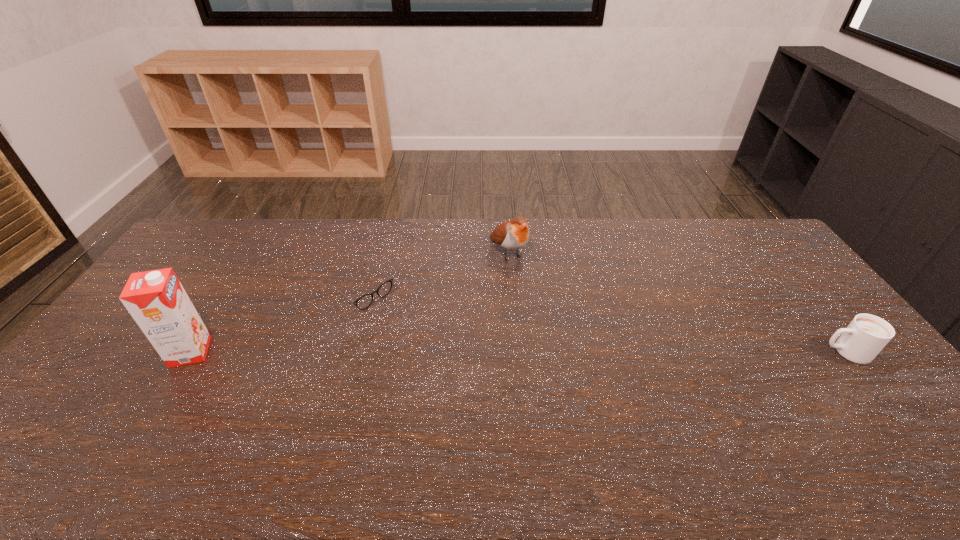
The width and height of the screenshot is (960, 540). In order to click on vacant area at the far edge of the desktop in this screenshot , I will do `click(343, 253)`.

This screenshot has width=960, height=540. Find the location of `blank area at the left edge`. blank area at the left edge is located at coordinates (178, 271).

In order to click on free region at the right edge of the desktop in this screenshot , I will do (796, 297).

Identify the location of vacant area at the near left corner. (45, 414).

This screenshot has width=960, height=540. In order to click on vacant space at the near right corner in this screenshot , I will do `click(848, 409)`.

The image size is (960, 540). I want to click on free space between the shortest object and the cappuccino, so click(x=603, y=321).

Identify the location of free point between the rightmost object and the third shortest object. (677, 302).

At what (x,y) coordinates should I click in order to perform the action: click on vacant point located between the shortest object and the leftmost object. Please return your answer as a coordinate pair (x, y). This screenshot has height=540, width=960. Looking at the image, I should click on (276, 321).

Locate an element on the screen. This screenshot has height=540, width=960. free space between the third shortest object and the tallest object is located at coordinates (349, 302).

Identify the location of unoccupied position between the second shortest object and the third shortest object. (677, 302).